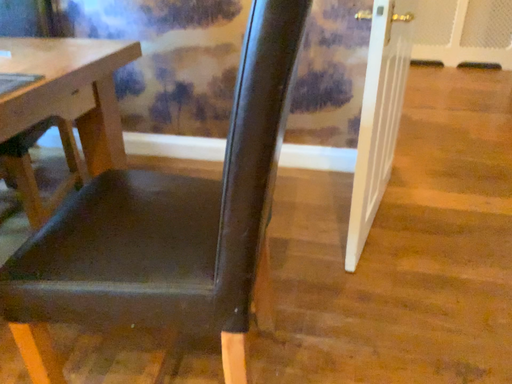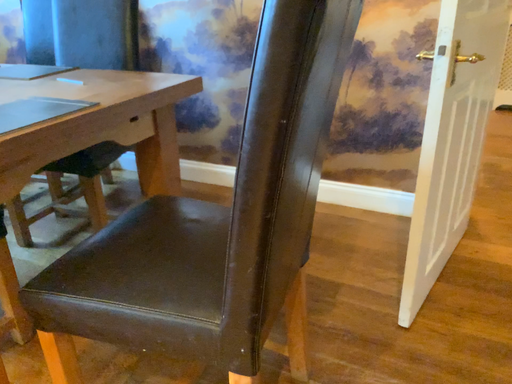
Question: How did the camera likely rotate when shooting the video?

Choices:
 (A) rotated right
 (B) rotated left

Answer: (B)